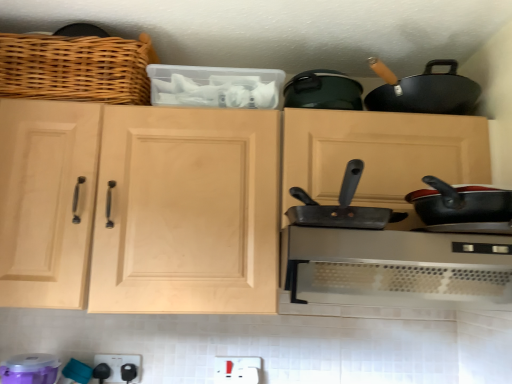
Question: Is natural wood cabinet at center further to the viewer compared to purple plastic container at lower left, which appears as the 2th appliance when viewed from the back?

Choices:
 (A) no
 (B) yes

Answer: (B)

Question: Could purple plastic container at lower left, which is the 2th appliance in right-to-left order, be considered to be inside natural wood cabinet at center?

Choices:
 (A) yes
 (B) no

Answer: (B)

Question: From a real-world perspective, is natural wood cabinet at center below purple plastic container at lower left, which is the 2th appliance in right-to-left order?

Choices:
 (A) no
 (B) yes

Answer: (A)

Question: From the image's perspective, is natural wood cabinet at center below purple plastic container at lower left, which appears as the 2th appliance when viewed from the back?

Choices:
 (A) yes
 (B) no

Answer: (B)

Question: Can you confirm if natural wood cabinet at center is smaller than purple plastic container at lower left, marked as the first appliance in a left-to-right arrangement?

Choices:
 (A) yes
 (B) no

Answer: (B)

Question: Is point (59, 76) positioned closer to the camera than point (133, 355)?

Choices:
 (A) farther
 (B) closer

Answer: (B)

Question: In the image, is woven wood basket at upper left on the left side or the right side of black plastic outlet at lower center, arranged as the first appliance when viewed from the right?

Choices:
 (A) left
 (B) right

Answer: (A)

Question: From a real-world perspective, is woven wood basket at upper left above or below black plastic outlet at lower center, which is counted as the 1th appliance, starting from the back?

Choices:
 (A) above
 (B) below

Answer: (A)

Question: In terms of size, does woven wood basket at upper left appear bigger or smaller than black plastic outlet at lower center, arranged as the first appliance when viewed from the right?

Choices:
 (A) small
 (B) big

Answer: (B)

Question: In terms of width, does purple plastic container at lower left, which appears as the 2th appliance when viewed from the back, look wider or thinner when compared to natural wood cabinet at center?

Choices:
 (A) thin
 (B) wide

Answer: (A)

Question: Is point (35, 354) positioned closer to the camera than point (234, 150)?

Choices:
 (A) farther
 (B) closer

Answer: (A)

Question: In terms of height, does purple plastic container at lower left, the first appliance viewed from the front, look taller or shorter compared to natural wood cabinet at center?

Choices:
 (A) short
 (B) tall

Answer: (A)

Question: In terms of size, does purple plastic container at lower left, which is the 2th appliance in right-to-left order, appear bigger or smaller than natural wood cabinet at center?

Choices:
 (A) big
 (B) small

Answer: (B)

Question: From the image's perspective, is metallic gray frying pan at center located above or below woven wood basket at upper left?

Choices:
 (A) below
 (B) above

Answer: (A)

Question: From a real-world perspective, is metallic gray frying pan at center positioned above or below woven wood basket at upper left?

Choices:
 (A) above
 (B) below

Answer: (B)